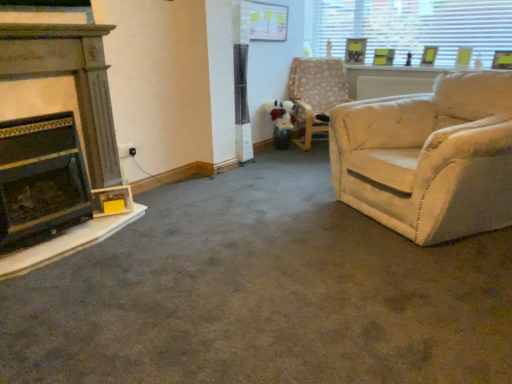
Question: Visually, is wooden fireplace at left, arranged as the first fireplace when viewed from the top, positioned to the left or to the right of beige fabric chair at upper right?

Choices:
 (A) right
 (B) left

Answer: (B)

Question: From the image's perspective, is wooden fireplace at left, arranged as the first fireplace when viewed from the top, above or below beige fabric chair at upper right?

Choices:
 (A) above
 (B) below

Answer: (B)

Question: Which of these objects is positioned farthest from the wooden fireplace at left, arranged as the first fireplace when viewed from the top?

Choices:
 (A) transparent glass window at upper right
 (B) wooden picture frame at upper right, arranged as the 1th picture frame when viewed from the left
 (C) wooden picture frame at upper right, arranged as the 2th picture frame when viewed from the left
 (D) black matte fireplace at left, positioned as the 2th fireplace in top-to-bottom order
 (E) matte yellow picture frame at upper right, which appears as the first picture frame when viewed from the right

Answer: (E)

Question: Based on their relative distances, which object is farther from the matte yellow picture frame at upper right, the 3th picture frame positioned from the left?

Choices:
 (A) wooden picture frame at upper right, the second picture frame positioned from the right
 (B) beige fabric chair at upper right
 (C) transparent glass window at upper right
 (D) wooden picture frame at upper right, acting as the 3th picture frame starting from the right
 (E) wooden fireplace at left, arranged as the second fireplace when ordered from the bottom

Answer: (E)